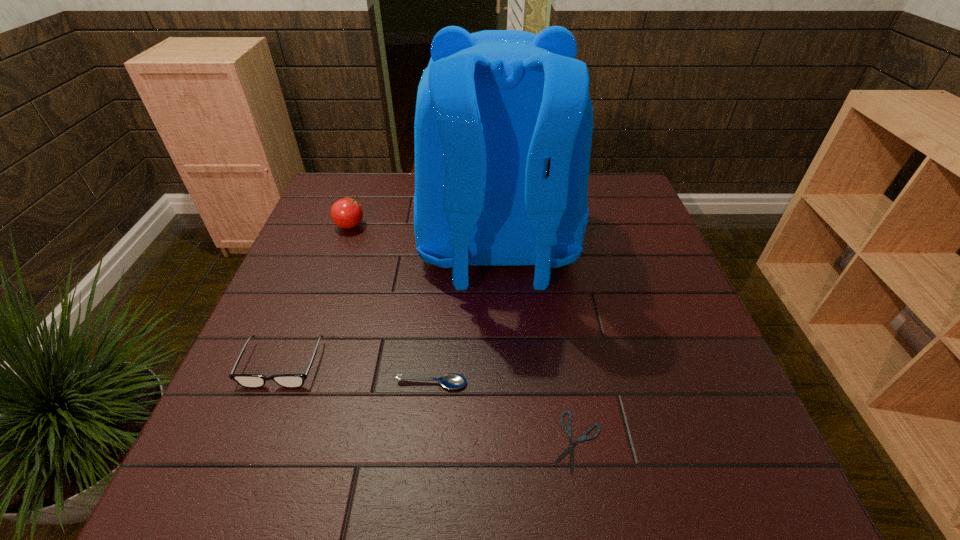
You are a GUI agent. You are given a task and a screenshot of the screen. Output one action in this format:
    pyautogui.click(x=<x>, y=<y>)
    Task: Click on the free space located 0.350m on the left of the shears
    This screenshot has width=960, height=540.
    Given the screenshot: What is the action you would take?
    352,441

This screenshot has width=960, height=540. What are the coordinates of `object that is at the far edge` in the screenshot? It's located at (503, 127).

Locate an element on the screen. object that is at the near edge is located at coordinates (568, 430).

You are a GUI agent. You are given a task and a screenshot of the screen. Output one action in this format:
    pyautogui.click(x=<x>, y=<y>)
    Task: Click on the apple that is at the left edge
    The image size is (960, 540).
    Given the screenshot: What is the action you would take?
    pyautogui.click(x=347, y=213)

This screenshot has width=960, height=540. Find the location of `spectacles positioned at the left edge`. spectacles positioned at the left edge is located at coordinates (245, 380).

You are a GUI agent. You are given a task and a screenshot of the screen. Output one action in this format:
    pyautogui.click(x=<x>, y=<y>)
    Task: Click on the free space at the near edge
    
    Given the screenshot: What is the action you would take?
    pyautogui.click(x=610, y=461)

Find the location of a particular element. vacant space at the left edge of the desktop is located at coordinates (289, 308).

This screenshot has width=960, height=540. What are the coordinates of `vacant region at the right edge of the desktop` in the screenshot? It's located at (597, 228).

Image resolution: width=960 pixels, height=540 pixels. Identify the location of vacant space at the far left corner of the desktop. (358, 182).

Image resolution: width=960 pixels, height=540 pixels. In the image, there is a desktop. Identify the location of free region at the far right corner. [593, 190].